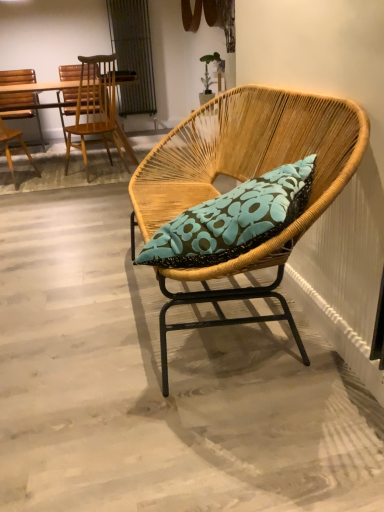
Question: Is wooden chair at upper left, which is counted as the second chair, starting from the back, positioned in front of woven wood chair at center, marked as the 1th chair in a front-to-back arrangement?

Choices:
 (A) yes
 (B) no

Answer: (B)

Question: Is woven wood chair at center, the 1th chair viewed from the right, inside wooden chair at upper left, which is counted as the second chair, starting from the right?

Choices:
 (A) yes
 (B) no

Answer: (B)

Question: Considering the relative positions of wooden chair at upper left, which is counted as the second chair, starting from the back, and woven wood chair at center, marked as the 1th chair in a front-to-back arrangement, in the image provided, is wooden chair at upper left, which is counted as the second chair, starting from the back, behind woven wood chair at center, marked as the 1th chair in a front-to-back arrangement,?

Choices:
 (A) yes
 (B) no

Answer: (A)

Question: Does wooden chair at upper left, positioned as the second chair in front-to-back order, have a smaller size compared to woven wood chair at center, which ranks as the third chair in left-to-right order?

Choices:
 (A) yes
 (B) no

Answer: (A)

Question: Is wooden chair at upper left, positioned as the second chair in front-to-back order, completely or partially outside of woven wood chair at center, marked as the 1th chair in a front-to-back arrangement?

Choices:
 (A) no
 (B) yes

Answer: (B)

Question: Is the surface of wooden chair at upper left, positioned as the second chair in front-to-back order, in direct contact with woven wood chair at center, the 1th chair viewed from the right?

Choices:
 (A) yes
 (B) no

Answer: (B)

Question: Is woven wood chair at center, the 3th chair in the back-to-front sequence, outside wooden chair at upper left, positioned as the second chair in front-to-back order?

Choices:
 (A) yes
 (B) no

Answer: (A)

Question: From a real-world perspective, does woven wood chair at center, the 3th chair in the back-to-front sequence, sit lower than wooden chair at upper left, positioned as the second chair in front-to-back order?

Choices:
 (A) yes
 (B) no

Answer: (A)

Question: Is woven wood chair at center, which ranks as the third chair in left-to-right order, oriented towards wooden chair at upper left, positioned as the second chair in front-to-back order?

Choices:
 (A) no
 (B) yes

Answer: (A)

Question: Is wooden chair at upper left, which is counted as the second chair, starting from the right, surrounded by woven wood chair at center, the 1th chair viewed from the right?

Choices:
 (A) yes
 (B) no

Answer: (B)

Question: Is woven wood chair at center, the 3th chair in the back-to-front sequence, shorter than wooden chair at upper left, which is counted as the 2th chair, starting from the left?

Choices:
 (A) no
 (B) yes

Answer: (B)

Question: Considering the relative sizes of woven wood chair at center, the 1th chair viewed from the right, and wooden chair at upper left, which is counted as the second chair, starting from the back, in the image provided, is woven wood chair at center, the 1th chair viewed from the right, smaller than wooden chair at upper left, which is counted as the second chair, starting from the back,?

Choices:
 (A) yes
 (B) no

Answer: (B)

Question: From the image's perspective, is woven wood chair at center, the 3th chair in the back-to-front sequence, over wooden chair at left, the 3th chair viewed from the front?

Choices:
 (A) no
 (B) yes

Answer: (A)